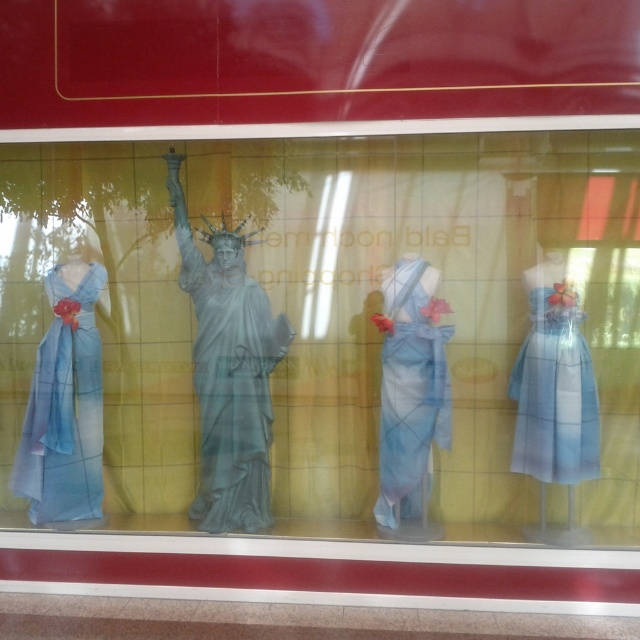
Between matte blue statue at center and matte blue fabric dress at center, which one has more height?

Standing taller between the two is matte blue statue at center.

Who is more forward, (572, 179) or (403, 513)?

Point (572, 179) is in front.

Image resolution: width=640 pixels, height=640 pixels. In order to click on matte blue statue at center in this screenshot , I will do `click(323, 336)`.

Is bronze statue at center bigger than matte blue fabric dress at center?

Yes, bronze statue at center is bigger than matte blue fabric dress at center.

Which is in front, point (214, 390) or point (392, 353)?

Positioned in front is point (392, 353).

Between point (204, 474) and point (408, 378), which one is positioned behind?

The point (204, 474) is behind.

Locate an element on the screen. The width and height of the screenshot is (640, 640). bronze statue at center is located at coordinates (228, 371).

Can you confirm if bronze statue at center is taller than light blue sheer dress at right?

Correct, bronze statue at center is much taller as light blue sheer dress at right.

Based on the photo, is bronze statue at center further to the viewer compared to light blue sheer dress at right?

Yes, bronze statue at center is further from the viewer.

Where is `bronze statue at center`? This screenshot has height=640, width=640. bronze statue at center is located at coordinates (228, 371).